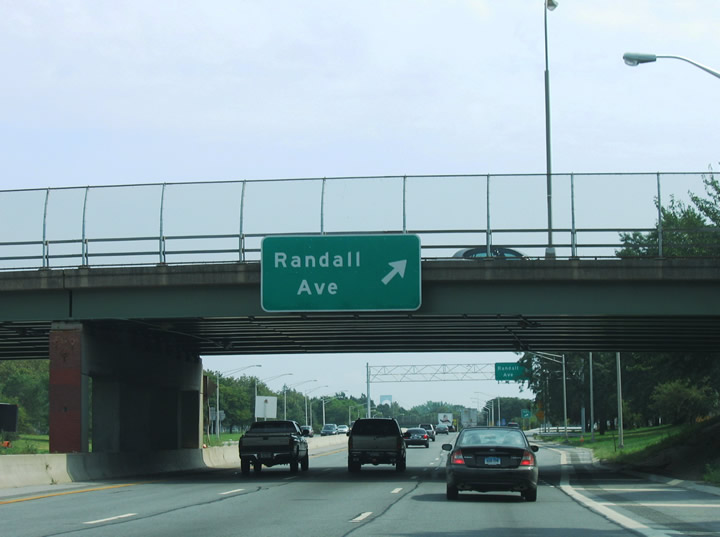
Find the location of a particular element. This screenshot has width=720, height=537. window is located at coordinates (379, 437).